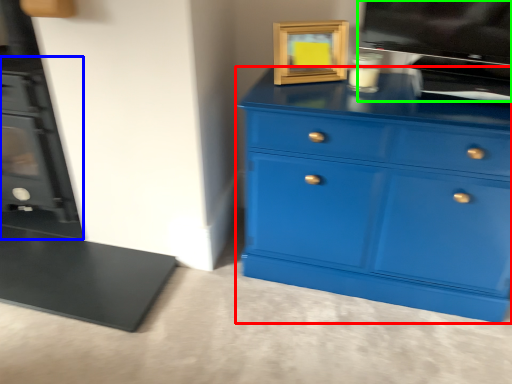
Question: Based on their relative distances, which object is farther from chest of drawers (highlighted by a red box)? Choose from fireplace (highlighted by a blue box) and appliance (highlighted by a green box).

Choices:
 (A) fireplace
 (B) appliance

Answer: (A)